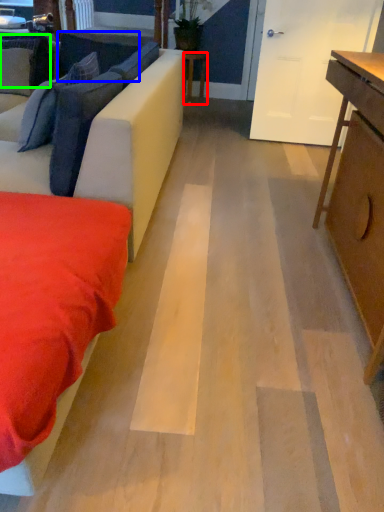
Question: Which object is positioned closest to table (highlighted by a red box)? Select from pillow (highlighted by a blue box) and pillow (highlighted by a green box).

Choices:
 (A) pillow
 (B) pillow

Answer: (A)